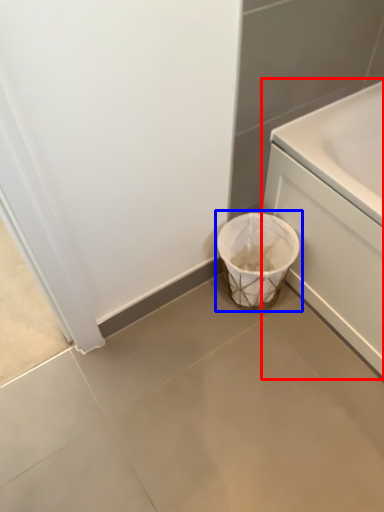
Question: Which object is closer to the camera taking this photo, bath (highlighted by a red box) or waste container (highlighted by a blue box)?

Choices:
 (A) bath
 (B) waste container

Answer: (A)